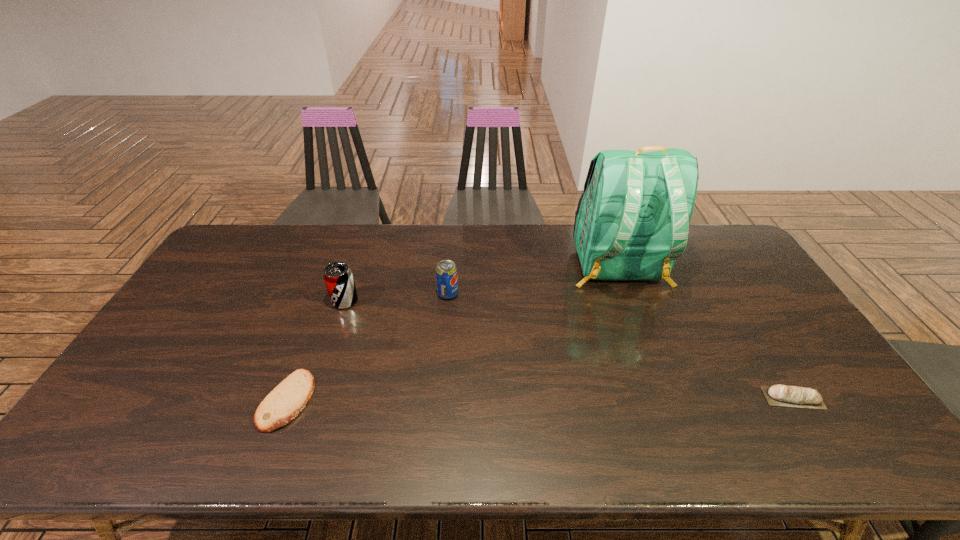
Image resolution: width=960 pixels, height=540 pixels. I want to click on the second object from right to left, so click(x=632, y=222).

The width and height of the screenshot is (960, 540). Identify the location of the tallest object. (632, 222).

Identify the location of the left soda. Image resolution: width=960 pixels, height=540 pixels. (338, 277).

Locate an element on the screen. the right soda is located at coordinates (446, 272).

Locate an element on the screen. Image resolution: width=960 pixels, height=540 pixels. the right pita bread is located at coordinates (807, 398).

At what (x,y) coordinates should I click in order to perform the action: click on the left pita bread. Please return your answer as a coordinate pair (x, y). Looking at the image, I should click on (286, 401).

Identify the location of free spot located on the back of the backpack. The height and width of the screenshot is (540, 960). (637, 318).

Identify the location of vacant position located on the back of the left soda. The width and height of the screenshot is (960, 540). (365, 242).

At what (x,y) coordinates should I click in order to perform the action: click on blank space located on the front of the third object from right to left. Please return your answer as a coordinate pair (x, y). The height and width of the screenshot is (540, 960). Looking at the image, I should click on (446, 315).

I want to click on free spot located on the left of the rightmost object, so click(634, 397).